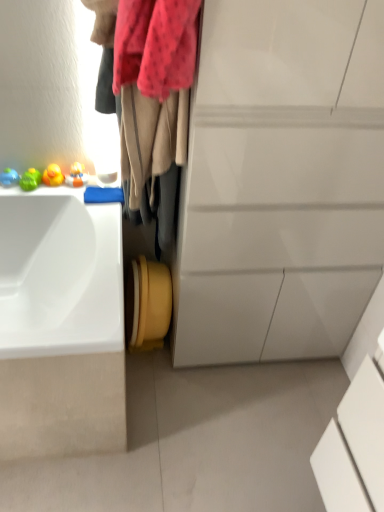
Locate an element on the screen. The height and width of the screenshot is (512, 384). white glossy cabinet at center is located at coordinates (281, 182).

The height and width of the screenshot is (512, 384). In order to click on white glossy cabinet at center in this screenshot , I will do 281,182.

Can you tell me how much white glossy sink at left and white glossy cabinet at center differ in facing direction?

0.613 degrees separate the facing orientations of white glossy sink at left and white glossy cabinet at center.

Between white glossy sink at left and white glossy cabinet at center, which one appears on the left side from the viewer's perspective?

A: white glossy sink at left.

From the image's perspective, is white glossy sink at left located above or below white glossy cabinet at center?

Based on their image positions, white glossy sink at left is located beneath white glossy cabinet at center.

Can you confirm if white glossy sink at left is smaller than white glossy cabinet at center?

Correct, white glossy sink at left occupies less space than white glossy cabinet at center.

From the image's perspective, who appears lower, velvet beige scarf at upper left or white glossy sink at left?

white glossy sink at left appears lower in the image.

Is velvet beige scarf at upper left wider than white glossy sink at left?

No.

Would you say velvet beige scarf at upper left is to the left or to the right of white glossy sink at left in the picture?

velvet beige scarf at upper left is positioned on white glossy sink at left's right side.

From a real-world perspective, which object stands above the other?

In real-world perspective, velvet beige scarf at upper left is above.

How many degrees apart are the facing directions of white glossy cabinet at center and velvet beige scarf at upper left?

There is a 88.9-degree angle between the facing directions of white glossy cabinet at center and velvet beige scarf at upper left.

Is white glossy cabinet at center placed right next to velvet beige scarf at upper left?

white glossy cabinet at center and velvet beige scarf at upper left are not in contact.

From the image's perspective, who appears lower, white glossy cabinet at center or velvet beige scarf at upper left?

From the image's view, white glossy cabinet at center is below.

Which object is positioned more to the left, white glossy sink at left or velvet beige scarf at upper left?

white glossy sink at left.

Considering the sizes of white glossy sink at left and velvet beige scarf at upper left in the image, is white glossy sink at left bigger or smaller than velvet beige scarf at upper left?

Clearly, white glossy sink at left is larger in size than velvet beige scarf at upper left.

In the image, is white glossy sink at left positioned in front of or behind velvet beige scarf at upper left?

white glossy sink at left is positioned farther from the viewer than velvet beige scarf at upper left.

Could you tell me if white glossy sink at left is facing velvet beige scarf at upper left?

No, white glossy sink at left is not facing towards velvet beige scarf at upper left.

Which of these two, white glossy cabinet at center or white glossy sink at left, stands shorter?

white glossy sink at left is shorter.

Does point (279, 112) come in front of point (18, 328)?

Yes, it is in front of point (18, 328).

Based on their positions, is white glossy cabinet at center located to the left or right of white glossy sink at left?

white glossy cabinet at center is positioned on white glossy sink at left's right side.

From the image's perspective, would you say white glossy cabinet at center is positioned over white glossy sink at left?

Yes, from the image's perspective, white glossy cabinet at center is above white glossy sink at left.

Which of these two, velvet beige scarf at upper left or white glossy cabinet at center, is wider?

Wider between the two is white glossy cabinet at center.

Does velvet beige scarf at upper left appear on the left side of white glossy cabinet at center?

Correct, you'll find velvet beige scarf at upper left to the left of white glossy cabinet at center.

Could you tell me if velvet beige scarf at upper left is turned towards white glossy cabinet at center?

No, velvet beige scarf at upper left is not turned towards white glossy cabinet at center.

How much distance is there between velvet beige scarf at upper left and white glossy cabinet at center?

The distance of velvet beige scarf at upper left from white glossy cabinet at center is 10.38 inches.

Locate an element on the screen. The image size is (384, 512). sink on the left side of white glossy cabinet at center is located at coordinates (59, 274).

Find the location of a particular element. The width and height of the screenshot is (384, 512). sink below the velvet beige scarf at upper left (from a real-world perspective) is located at coordinates (59, 274).

Estimate the real-world distances between objects in this image. Which object is closer to white glossy sink at left, velvet beige scarf at upper left or white glossy cabinet at center?

velvet beige scarf at upper left lies closer to white glossy sink at left than the other object.

When comparing their distances from white glossy sink at left, does white glossy cabinet at center or velvet beige scarf at upper left seem closer?

Among the two, velvet beige scarf at upper left is located nearer to white glossy sink at left.

Estimate the real-world distances between objects in this image. Which object is closer to velvet beige scarf at upper left, white glossy sink at left or white glossy cabinet at center?

The object closer to velvet beige scarf at upper left is white glossy cabinet at center.

Based on their spatial positions, is white glossy sink at left or velvet beige scarf at upper left closer to white glossy cabinet at center?

velvet beige scarf at upper left.

Estimate the real-world distances between objects in this image. Which object is further from velvet beige scarf at upper left, white glossy cabinet at center or white glossy sink at left?

white glossy sink at left lies further to velvet beige scarf at upper left than the other object.

Considering their positions, is velvet beige scarf at upper left positioned further to white glossy cabinet at center than white glossy sink at left?

white glossy sink at left is positioned further to the anchor white glossy cabinet at center.

The image size is (384, 512). Find the location of `laundry located between white glossy sink at left and white glossy cabinet at center in the left-right direction`. laundry located between white glossy sink at left and white glossy cabinet at center in the left-right direction is located at coordinates (148, 97).